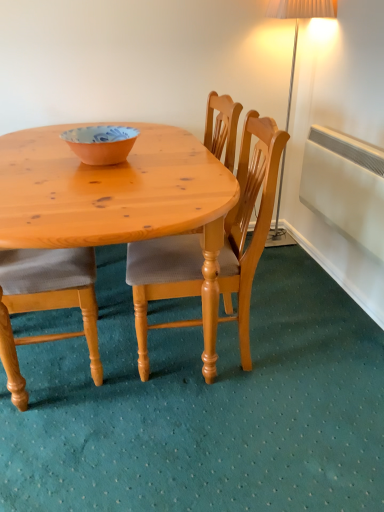
Identify the location of vacant space in front of light brown wooden chair at center. Image resolution: width=384 pixels, height=512 pixels. (209, 431).